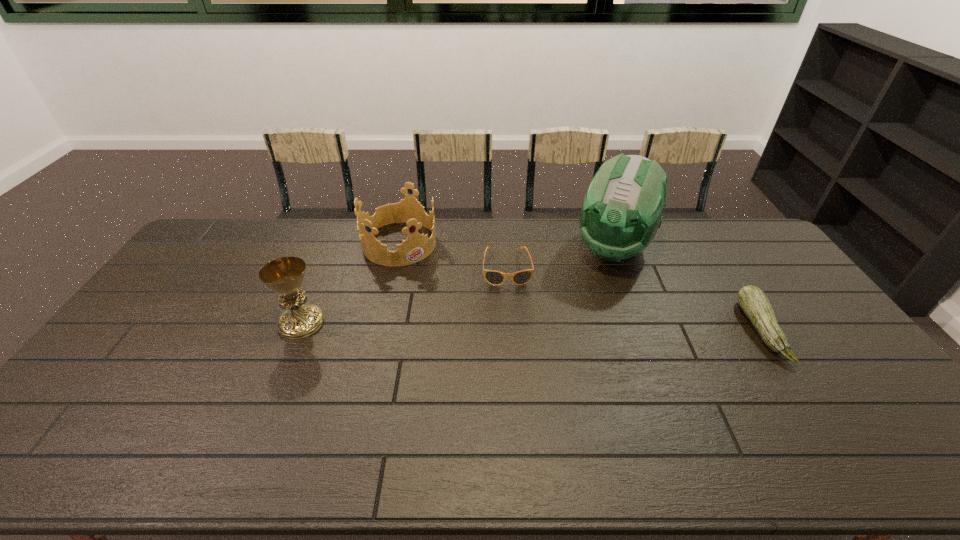
The image size is (960, 540). I want to click on free space on the desktop that is between the chalice and the rightmost object and is positioned on the visor of the tallest object, so click(x=577, y=327).

Identify the location of free space on the desktop that is between the leftmost object and the rightmost object and is positioned on the front-facing side of the third object from left to right. This screenshot has height=540, width=960. (512, 326).

Where is `vacant space on the desktop that is between the leftmost object and the rightmost object and is positioned on the front-facing side of the second object from left to right`? vacant space on the desktop that is between the leftmost object and the rightmost object and is positioned on the front-facing side of the second object from left to right is located at coordinates (475, 326).